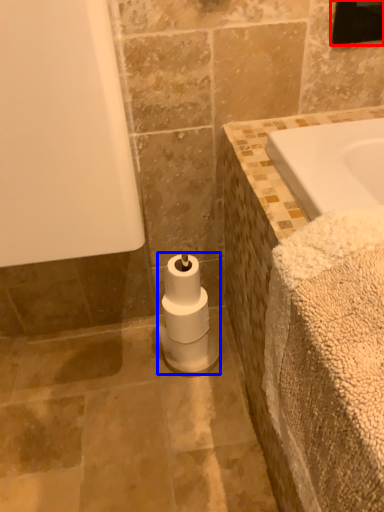
Question: Which object appears farthest to the camera in this image, mirror (highlighted by a red box) or toilet paper (highlighted by a blue box)?

Choices:
 (A) mirror
 (B) toilet paper

Answer: (B)